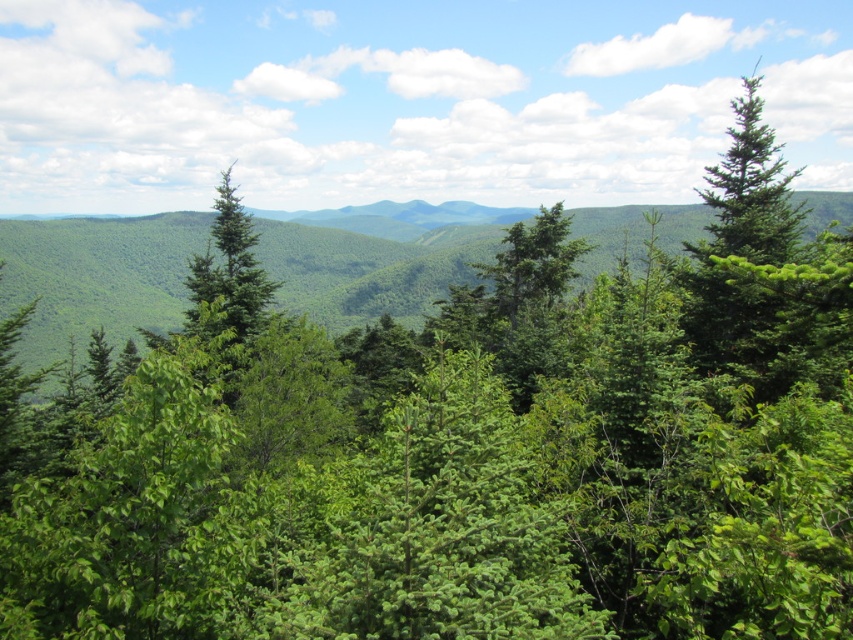
From the picture: Which is more to the left, green leafy forest at center or green leafy mountain at center?

From the viewer's perspective, green leafy mountain at center appears more on the left side.

Can you confirm if green leafy forest at center is positioned to the right of green leafy mountain at center?

Indeed, green leafy forest at center is positioned on the right side of green leafy mountain at center.

Does point (492, 563) come behind point (403, 275)?

That is False.

Image resolution: width=853 pixels, height=640 pixels. I want to click on green leafy forest at center, so (x=450, y=461).